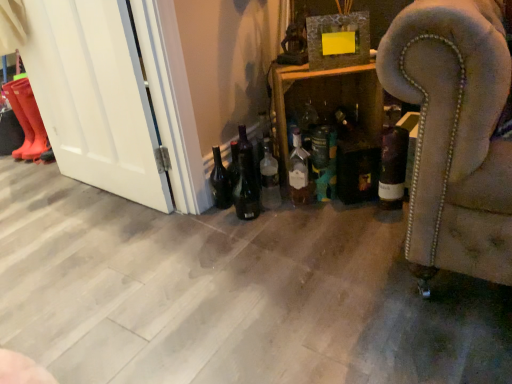
You are a GUI agent. You are given a task and a screenshot of the screen. Output one action in this format:
    pyautogui.click(x=<x>, y=<y>)
    Task: Click on the vacant point to the right of translucent glass bottle at center, placed as the first bottle when sorted from left to right
    Image resolution: width=512 pixels, height=384 pixels.
    Given the screenshot: What is the action you would take?
    pyautogui.click(x=310, y=208)